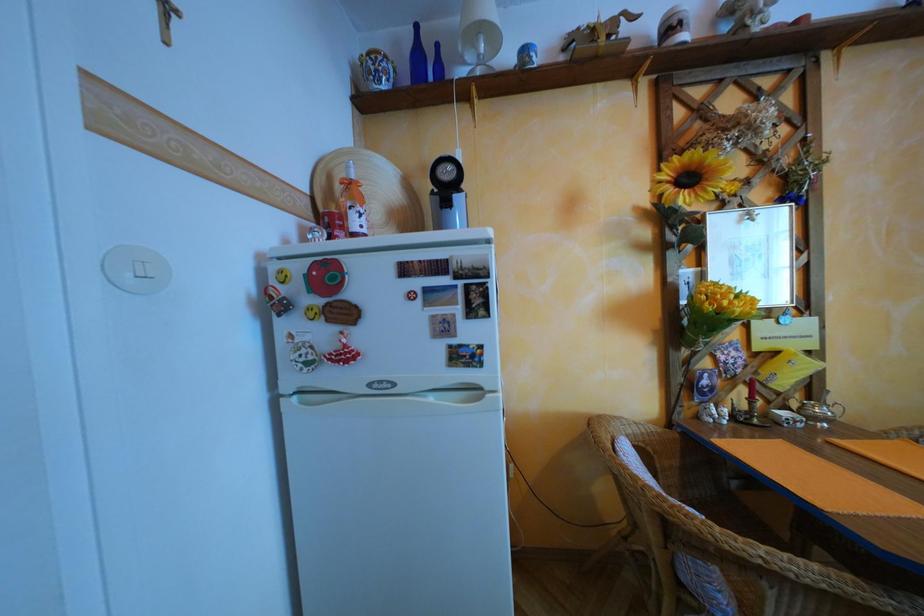
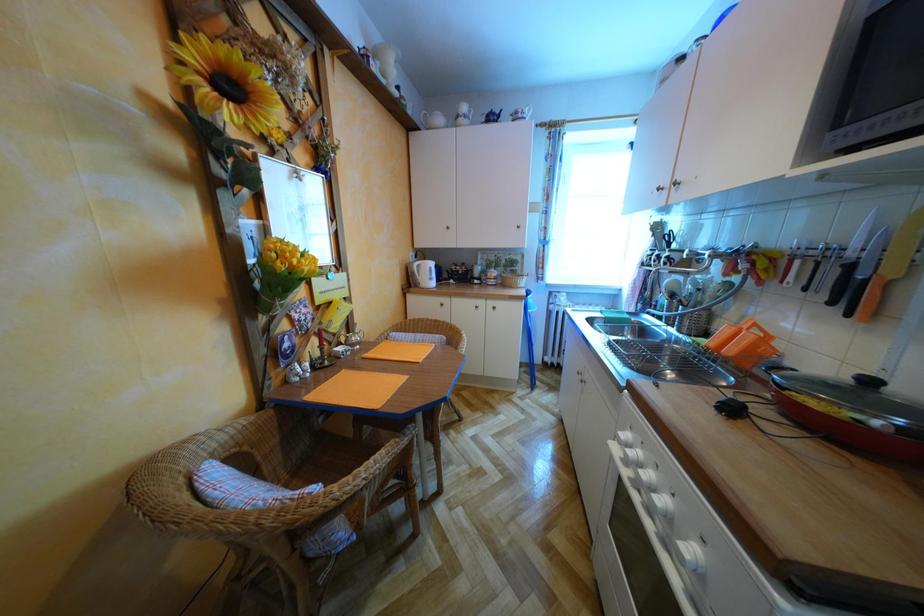
Question: How did the camera likely rotate?

Choices:
 (A) Left
 (B) Right
 (C) Up
 (D) Down

Answer: (B)